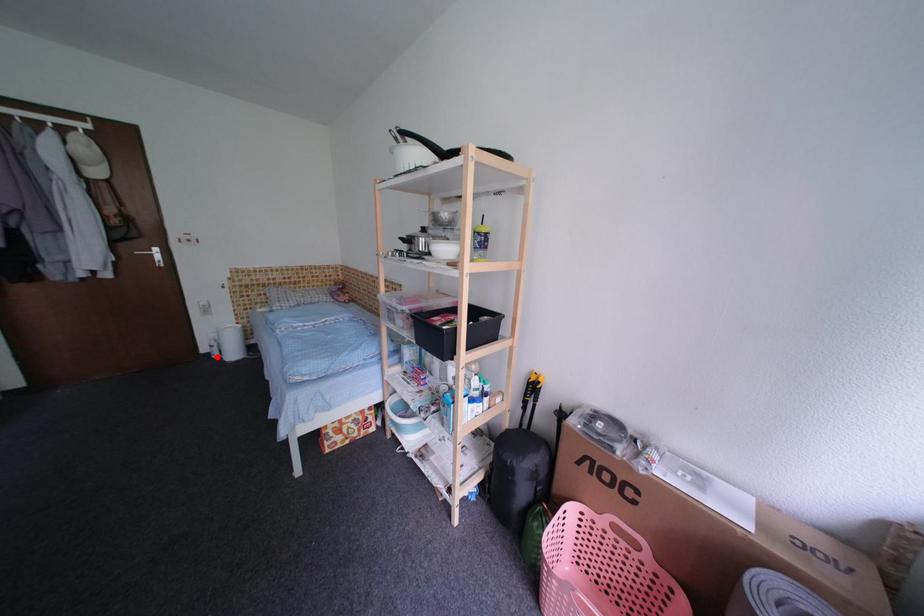
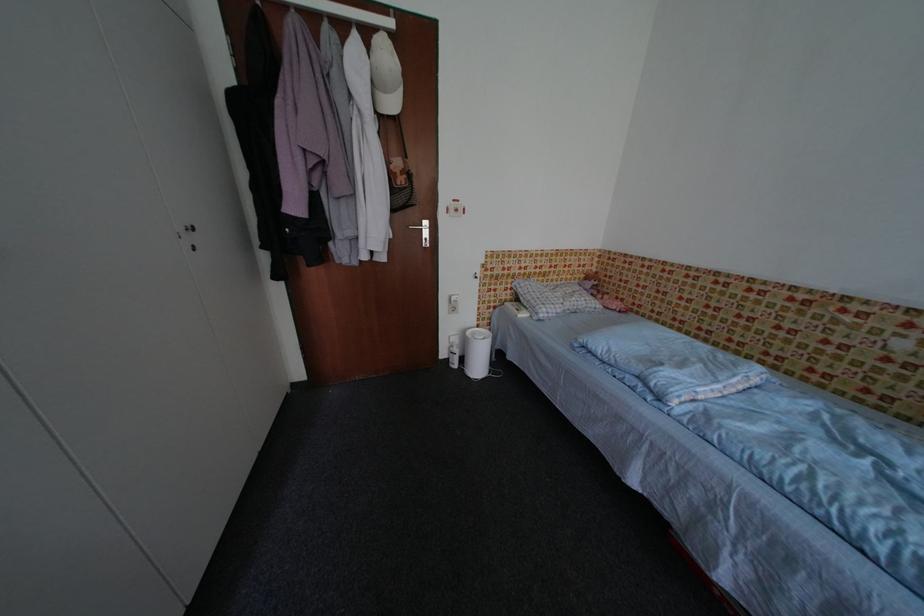
Find the pixel in the second image that matches the highlighted location in the first image.

(455, 363)